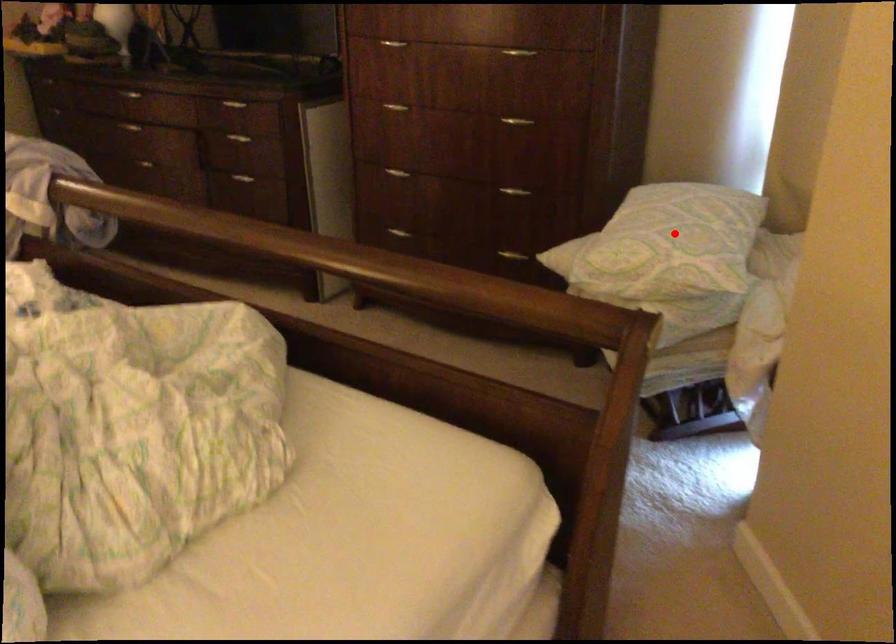
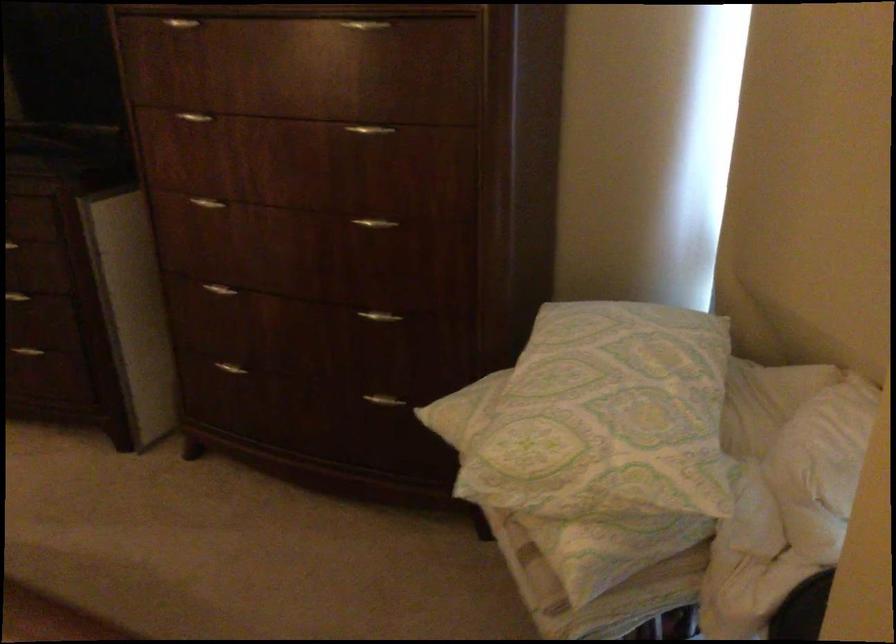
Question: I am providing you with two images of the same scene from different viewpoints. Given a red point in image1, look at the same physical point in image2. Is it:

Choices:
 (A) Closer to the viewpoint
 (B) Farther from the viewpoint

Answer: (A)